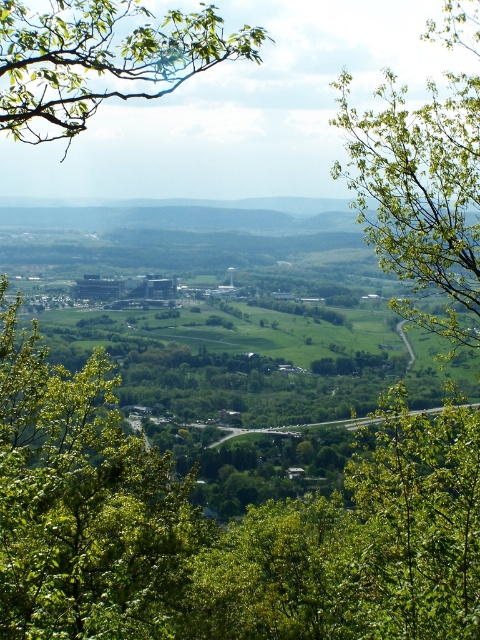
You are a hiker standing at the base of the green leafy tree at center. You want to reach the green leafy branch at upper left. Given that the average human walking speed is 3 miles per hour, how long would it take you to walk directly to the branch?

The green leafy tree at center and green leafy branch at upper left are 100.86 feet apart. Converting feet to miles, 100.86 feet is approximately 0.019 miles. At 3 mph, it would take roughly 0.019 miles divided by 3 mph equals 0.0063 hours, which is about 0.38 minutes or 23 seconds. So, it would take approximately 23 seconds to walk directly to the branch.

You are standing at the point marked by the coordinates point (223, 529) in the image. What is the nearest object to you?

The nearest object to you at point (223, 529) is the green leafy tree at center, as the coordinates mark its location.